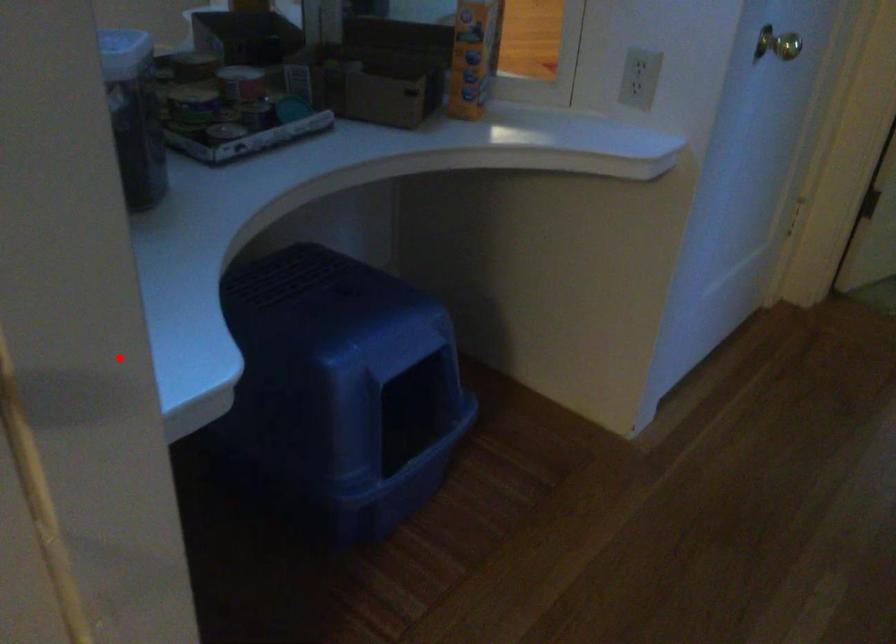
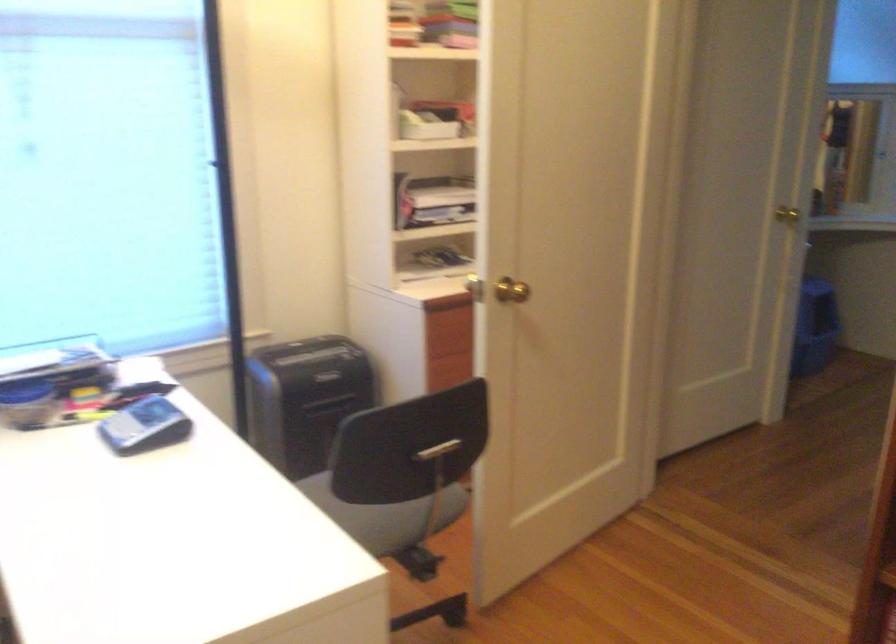
In the second image, find the point that corresponds to the highlighted location in the first image.

(787, 214)